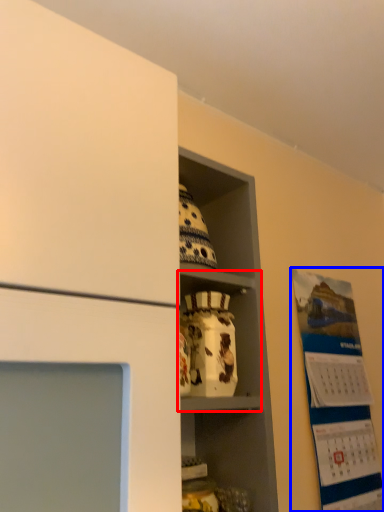
Question: Which object appears farthest to the camera in this image, cabinet (highlighted by a red box) or bulletin board (highlighted by a blue box)?

Choices:
 (A) cabinet
 (B) bulletin board

Answer: (B)